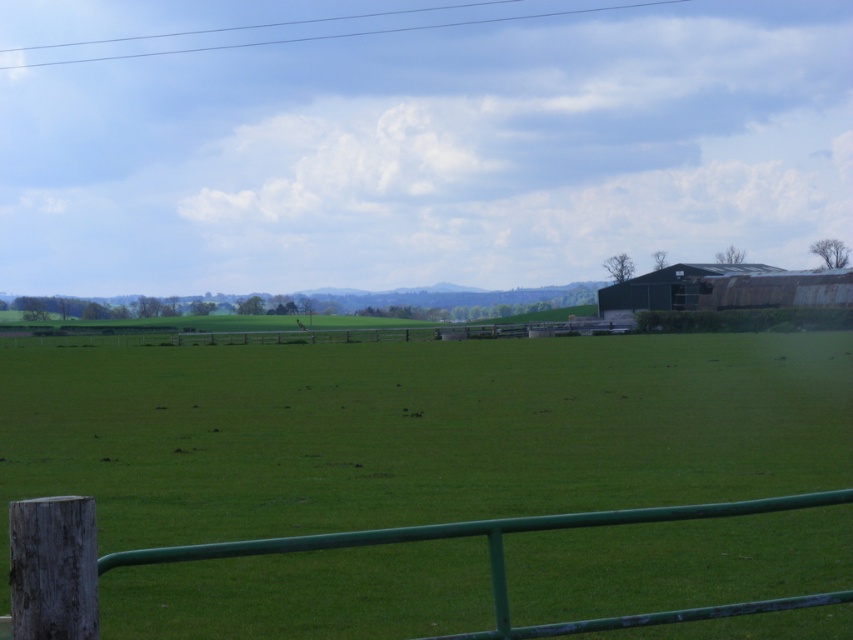
Question: Does green grass pasture at center lie behind green painted wood at lower center?

Choices:
 (A) yes
 (B) no

Answer: (A)

Question: Can you confirm if green grass pasture at center is bigger than green painted wood at lower center?

Choices:
 (A) no
 (B) yes

Answer: (B)

Question: From the image, what is the correct spatial relationship of green grass pasture at center in relation to green painted wood at lower center?

Choices:
 (A) right
 (B) left

Answer: (A)

Question: Which point is closer to the camera?

Choices:
 (A) pyautogui.click(x=474, y=372)
 (B) pyautogui.click(x=488, y=531)

Answer: (B)